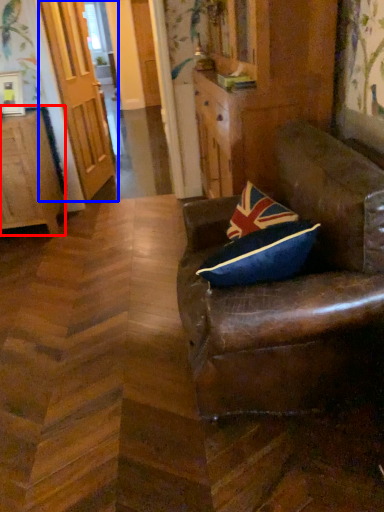
Question: Which object is further to the camera taking this photo, cabinetry (highlighted by a red box) or door (highlighted by a blue box)?

Choices:
 (A) cabinetry
 (B) door

Answer: (B)